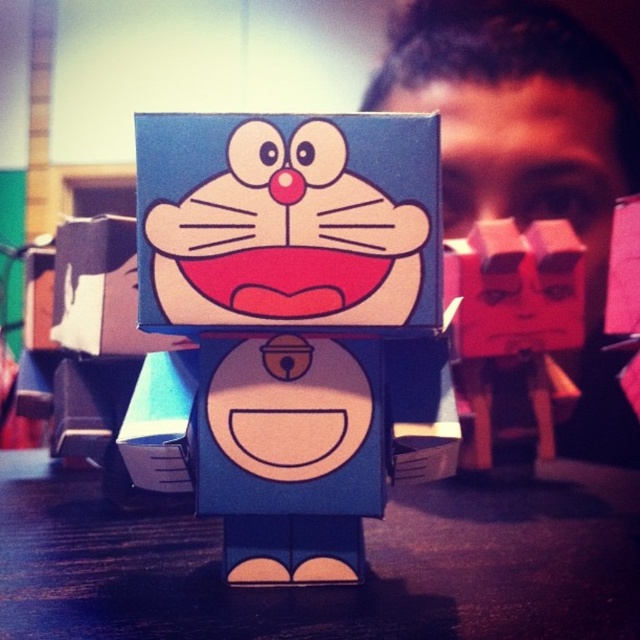
You are organizing a display for a Doraemon exhibition. You have a blue cardboard toy at center and a matte pink cube at right. If you want to arrange them side by side on a shelf, which one should be placed first to ensure they fit without overlapping?

The blue cardboard toy at center is wider than the matte pink cube at right, so you should place the blue cardboard toy at center first to accommodate its larger width.

Based on the photo, you are a character in the image and want to move from point (x=548, y=125) to point (x=458, y=182). Which direction should you move to get closer to the second point?

You should move downward because point (x=548, y=125) is above point (x=458, y=182), so moving downward will bring you closer.